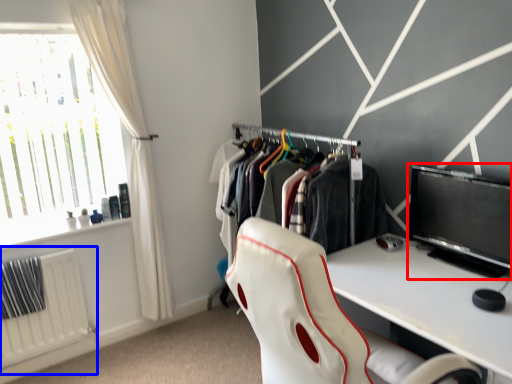
Question: Among these objects, which one is nearest to the camera, computer monitor (highlighted by a red box) or radiator (highlighted by a blue box)?

Choices:
 (A) computer monitor
 (B) radiator

Answer: (A)